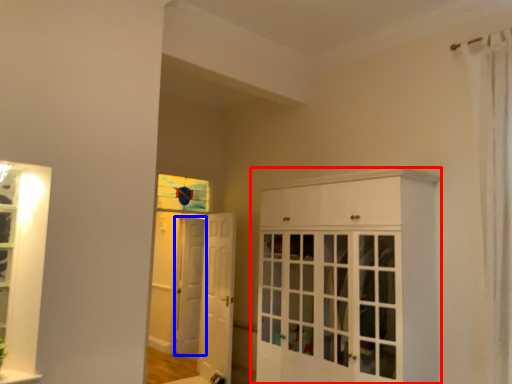
Question: Which object is closer to the camera taking this photo, cabinetry (highlighted by a red box) or door (highlighted by a blue box)?

Choices:
 (A) cabinetry
 (B) door

Answer: (A)